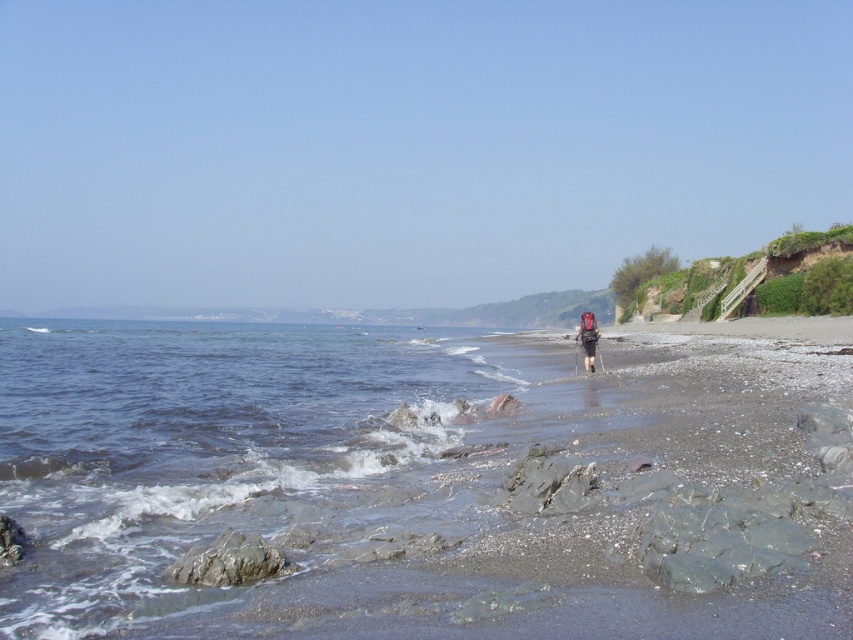
Question: Can you confirm if clear water at lower left is thinner than matte black backpack at center?

Choices:
 (A) yes
 (B) no

Answer: (B)

Question: Can you confirm if clear water at lower left is wider than matte black backpack at center?

Choices:
 (A) no
 (B) yes

Answer: (B)

Question: Is clear water at lower left to the right of matte black backpack at center from the viewer's perspective?

Choices:
 (A) yes
 (B) no

Answer: (B)

Question: Which point is farther from the camera taking this photo?

Choices:
 (A) (583, 349)
 (B) (115, 528)

Answer: (A)

Question: Which object is closer to the camera taking this photo?

Choices:
 (A) matte black backpack at center
 (B) clear water at lower left

Answer: (B)

Question: Among these objects, which one is nearest to the camera?

Choices:
 (A) matte black backpack at center
 (B) clear water at lower left

Answer: (B)